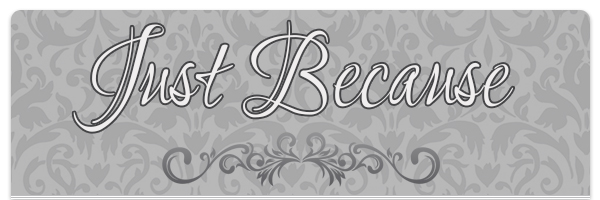
Locate an element on the screen. The height and width of the screenshot is (200, 600). damask pattern is located at coordinates (543, 125).